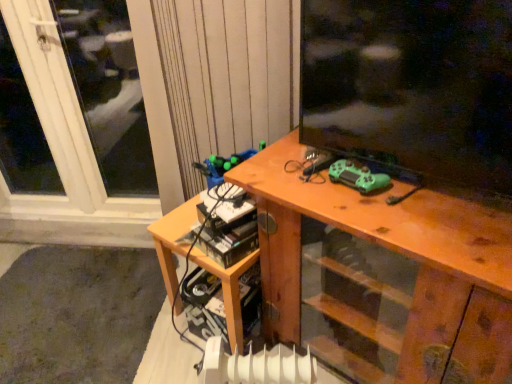
I want to click on free space in front of green matte game controller at center, so click(382, 215).